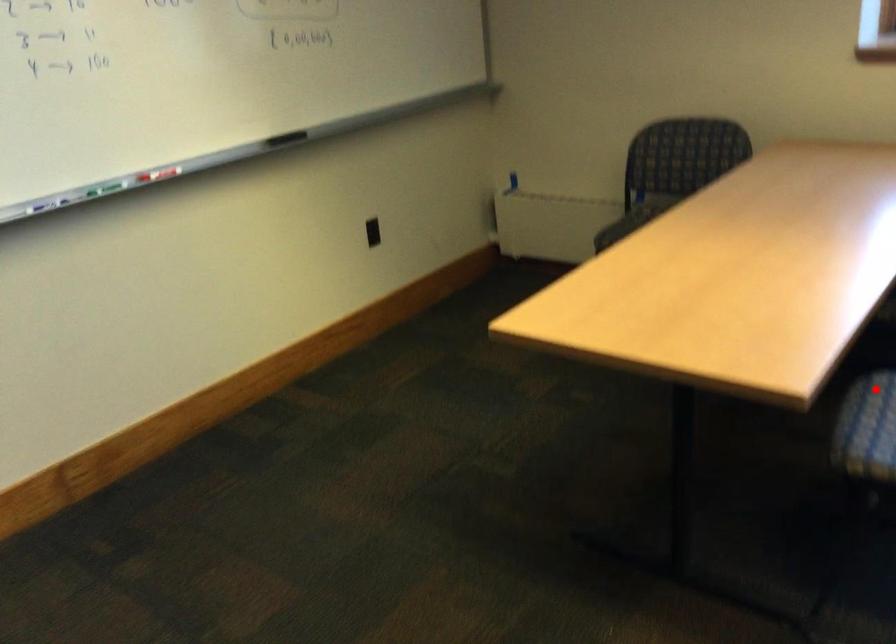
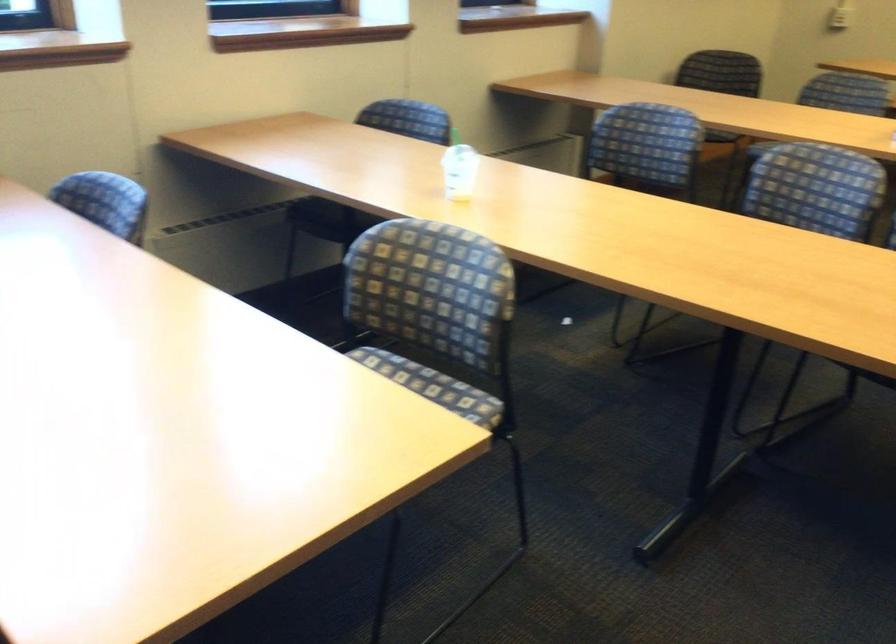
Question: I am providing you with two images of the same scene from different viewpoints. A red point is marked on the first image. Is the red point's position out of view in image 2?

Choices:
 (A) Yes
 (B) No

Answer: (A)